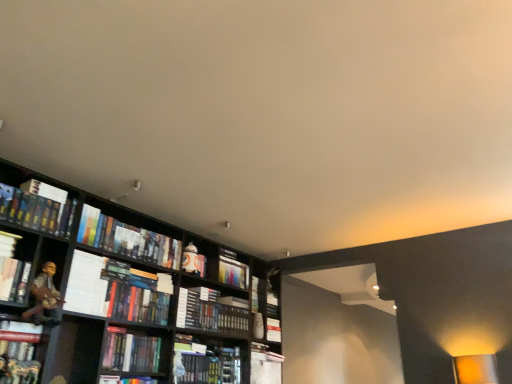
Question: From the image's perspective, does hardcover book at center, the eighth book in the left-to-right sequence, appear higher than hardcover book at center, the tenth book from the left?

Choices:
 (A) yes
 (B) no

Answer: (A)

Question: Does hardcover book at center, acting as the third book starting from the right, turn towards hardcover book at center, positioned as the first book in right-to-left order?

Choices:
 (A) no
 (B) yes

Answer: (A)

Question: Is hardcover book at center, the eighth book in the left-to-right sequence, next to hardcover book at center, positioned as the first book in right-to-left order?

Choices:
 (A) no
 (B) yes

Answer: (A)

Question: Is hardcover book at center, the eighth book in the left-to-right sequence, thinner than hardcover book at center, positioned as the first book in right-to-left order?

Choices:
 (A) no
 (B) yes

Answer: (A)

Question: Can you confirm if hardcover book at center, the eighth book in the left-to-right sequence, is taller than hardcover book at center, positioned as the first book in right-to-left order?

Choices:
 (A) no
 (B) yes

Answer: (B)

Question: From the image's perspective, is hardcover book at center, the eighth book in the left-to-right sequence, located beneath hardcover book at center, the tenth book from the left?

Choices:
 (A) no
 (B) yes

Answer: (A)

Question: Considering the relative sizes of white paper at left and hardcover book at center, acting as the third book starting from the right, in the image provided, is white paper at left wider than hardcover book at center, acting as the third book starting from the right,?

Choices:
 (A) no
 (B) yes

Answer: (A)

Question: Is white paper at left positioned behind hardcover book at center, acting as the third book starting from the right?

Choices:
 (A) no
 (B) yes

Answer: (A)

Question: Can we say white paper at left lies outside hardcover book at center, acting as the third book starting from the right?

Choices:
 (A) no
 (B) yes

Answer: (B)

Question: From a real-world perspective, is white paper at left located beneath hardcover book at center, the eighth book in the left-to-right sequence?

Choices:
 (A) yes
 (B) no

Answer: (A)

Question: Is white paper at left in contact with hardcover book at center, acting as the third book starting from the right?

Choices:
 (A) no
 (B) yes

Answer: (A)

Question: Is white paper at left to the left of hardcover book at center, acting as the third book starting from the right, from the viewer's perspective?

Choices:
 (A) no
 (B) yes

Answer: (B)

Question: Is hardcover book at center, marked as the sixth book in a right-to-left arrangement, bigger than hardcover book at left, the eighth book positioned from the right?

Choices:
 (A) yes
 (B) no

Answer: (B)